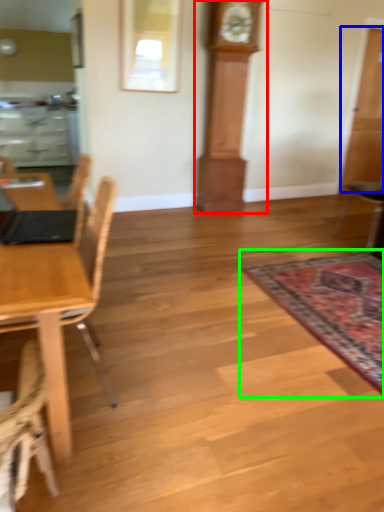
Question: Estimate the real-world distances between objects in this image. Which object is closer to clock (highlighted by a red box), glass door (highlighted by a blue box) or mat (highlighted by a green box)?

Choices:
 (A) glass door
 (B) mat

Answer: (A)